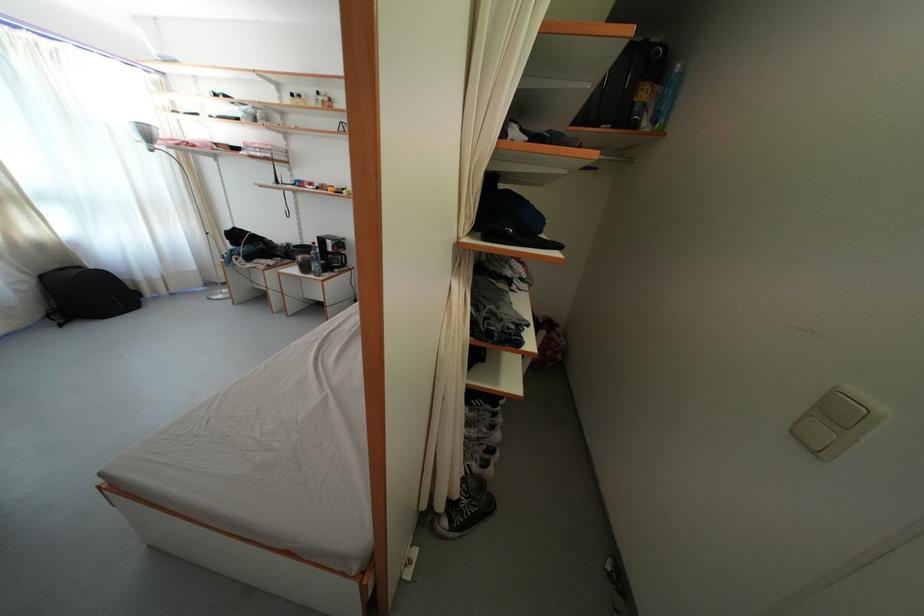
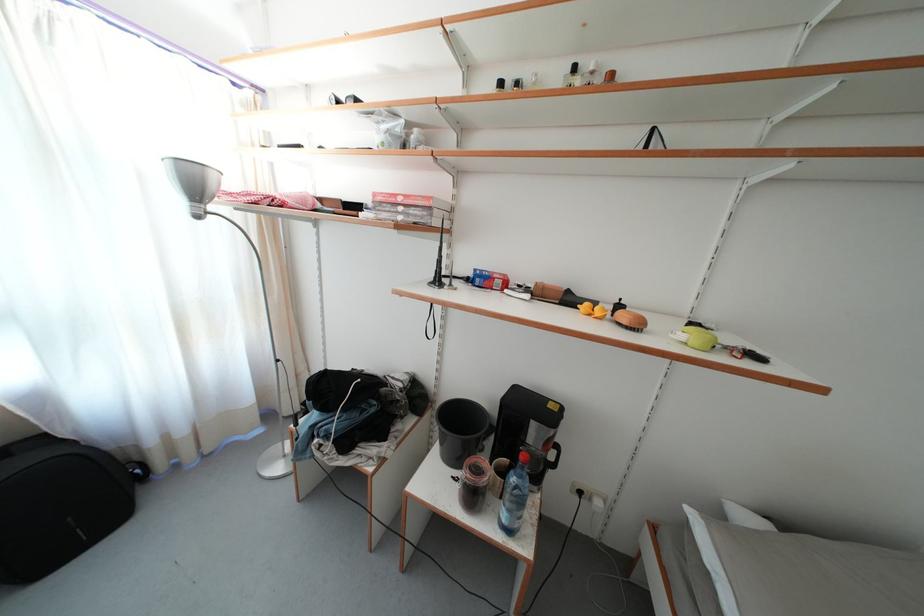
What movement of the cameraman would produce the second image?

The cameraman moved toward left, forward.